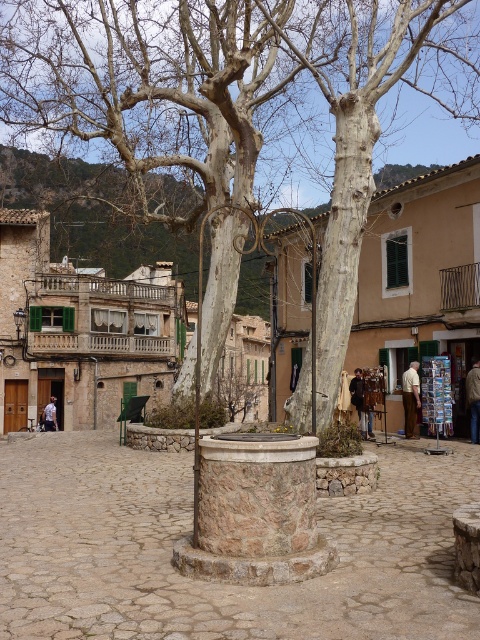
You are a GUI agent. You are given a task and a screenshot of the screen. Output one action in this format:
    pyautogui.click(x=<x>, y=<y>)
    Task: Click on the light brown leather jacket at lower right
    This screenshot has width=480, height=640.
    Given the screenshot: What is the action you would take?
    pyautogui.click(x=410, y=396)

Which is behind, point (403, 390) or point (369, 413)?

The point (369, 413) is more distant.

At what (x,y) coordinates should I click in order to perform the action: click on light brown leather jacket at lower right. Please return your answer as a coordinate pair (x, y). This screenshot has width=480, height=640. Looking at the image, I should click on (410, 396).

Can you confirm if smooth white bark at center is positioned to the left of light brown leather jacket at lower right?

In fact, smooth white bark at center is to the right of light brown leather jacket at lower right.

Between point (323, 24) and point (406, 406), which one is positioned behind?

Positioned behind is point (323, 24).

Where is `smooth white bark at center`? The height and width of the screenshot is (640, 480). smooth white bark at center is located at coordinates (372, 125).

Looking at this image, which of these two, dark brown leather jacket at center or light blue denim jacket at center, stands taller?

dark brown leather jacket at center

Does dark brown leather jacket at center appear on the left side of light blue denim jacket at center?

In fact, dark brown leather jacket at center is to the right of light blue denim jacket at center.

I want to click on dark brown leather jacket at center, so click(x=360, y=401).

The height and width of the screenshot is (640, 480). I want to click on dark brown leather jacket at center, so click(x=360, y=401).